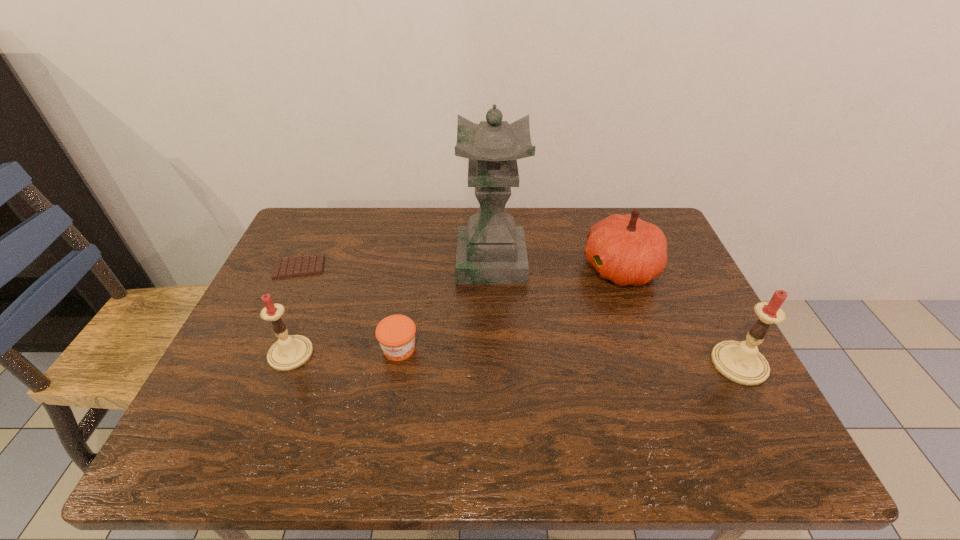
You are a GUI agent. You are given a task and a screenshot of the screen. Output one action in this format:
    pyautogui.click(x=<x>, y=<y>)
    Task: Click on the pumpkin that is at the far edge
    This screenshot has height=540, width=960.
    Given the screenshot: What is the action you would take?
    pyautogui.click(x=624, y=249)

The width and height of the screenshot is (960, 540). I want to click on object located in the near edge section of the desktop, so coord(741,362).

You are a GUI agent. You are given a task and a screenshot of the screen. Output one action in this format:
    pyautogui.click(x=<x>, y=<y>)
    Task: Click on the candle that is at the left edge
    
    Given the screenshot: What is the action you would take?
    pyautogui.click(x=290, y=351)

Identify the location of chocolate bar that is at the left edge. This screenshot has width=960, height=540. (306, 265).

Locate an element on the screen. This screenshot has height=540, width=960. candle that is positioned at the right edge is located at coordinates (741, 362).

Identify the location of pumpkin positioned at the right edge. Image resolution: width=960 pixels, height=540 pixels. (624, 249).

This screenshot has width=960, height=540. Find the location of `object located at the far right corner`. object located at the far right corner is located at coordinates [624, 249].

This screenshot has height=540, width=960. I want to click on object that is at the near right corner, so click(x=741, y=362).

Locate an element on the screen. The width and height of the screenshot is (960, 540). free space at the far edge is located at coordinates (387, 238).

Where is `vacant region at the near edge of the desktop`? vacant region at the near edge of the desktop is located at coordinates (388, 395).